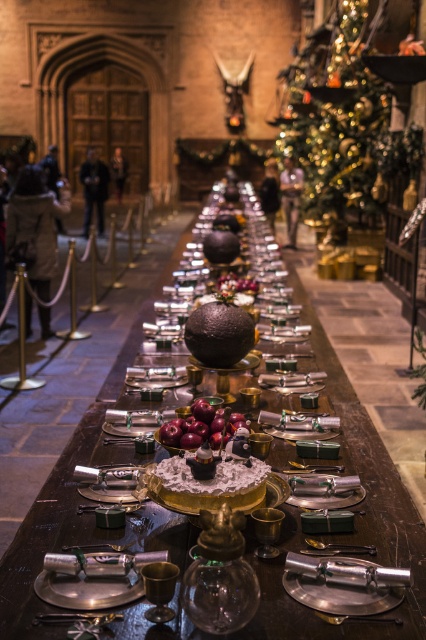
Does gold glittering christmas tree at upper right lie behind shiny chocolate sphere at center?

Yes, it is.

Which is in front, point (328, 38) or point (233, 353)?

Positioned in front is point (233, 353).

What are the coordinates of `gold glittering christmas tree at upper right` in the screenshot? It's located at (334, 115).

Between shiny silver table at center and gold glittering christmas tree at upper right, which one is positioned higher?

gold glittering christmas tree at upper right

Between shiny silver table at center and gold glittering christmas tree at upper right, which one has less height?

Standing shorter between the two is shiny silver table at center.

Identify the location of shiny silver table at center. (46, 531).

Is shiny chocolate sphere at center bigger than shiny red apples at center?

Yes, shiny chocolate sphere at center is bigger than shiny red apples at center.

Is shiny chocolate sphere at center closer to camera compared to shiny red apples at center?

That is False.

Find the location of a particular element. This screenshot has height=640, width=426. shiny chocolate sphere at center is located at coordinates click(x=218, y=333).